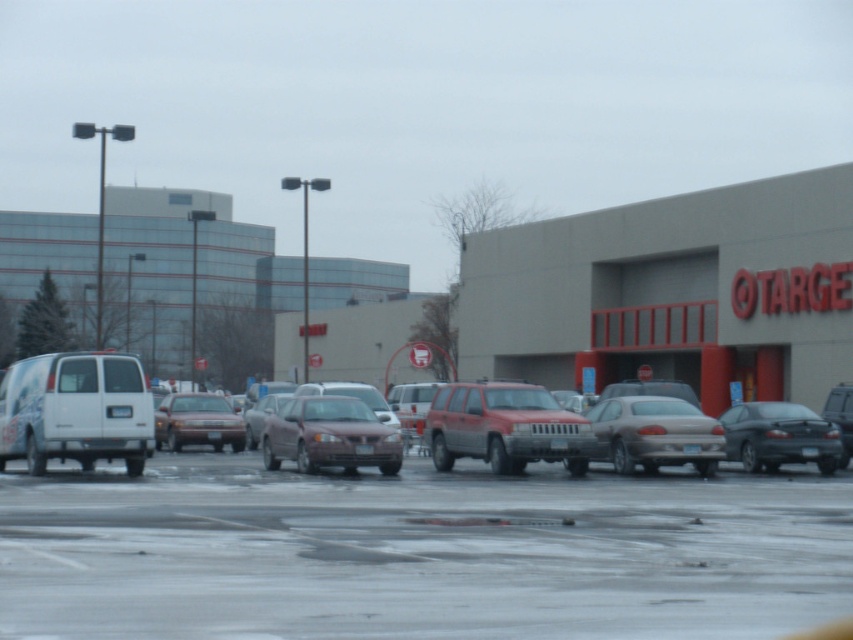
Question: Which object is positioned closest to the gold metallic sedan at center?

Choices:
 (A) red matte suv at center
 (B) white matte van at left
 (C) matte red sedan at center

Answer: (A)

Question: Can you confirm if gray concrete mall at center is smaller than matte red sedan at center?

Choices:
 (A) no
 (B) yes

Answer: (A)

Question: In this image, where is smooth asphalt parking lot at center located relative to red matte suv at center?

Choices:
 (A) above
 (B) below

Answer: (B)

Question: Among these points, which one is nearest to the camera?

Choices:
 (A) click(x=202, y=593)
 (B) click(x=216, y=433)
 (C) click(x=113, y=385)
 (D) click(x=820, y=452)

Answer: (A)

Question: Which point is farther to the camera?

Choices:
 (A) gray concrete mall at center
 (B) smooth asphalt parking lot at center
 (C) matte maroon sedan at center
 (D) gold metallic sedan at center

Answer: (A)

Question: Is dark gray metallic sedan at right thinner than matte red sedan at center?

Choices:
 (A) yes
 (B) no

Answer: (B)